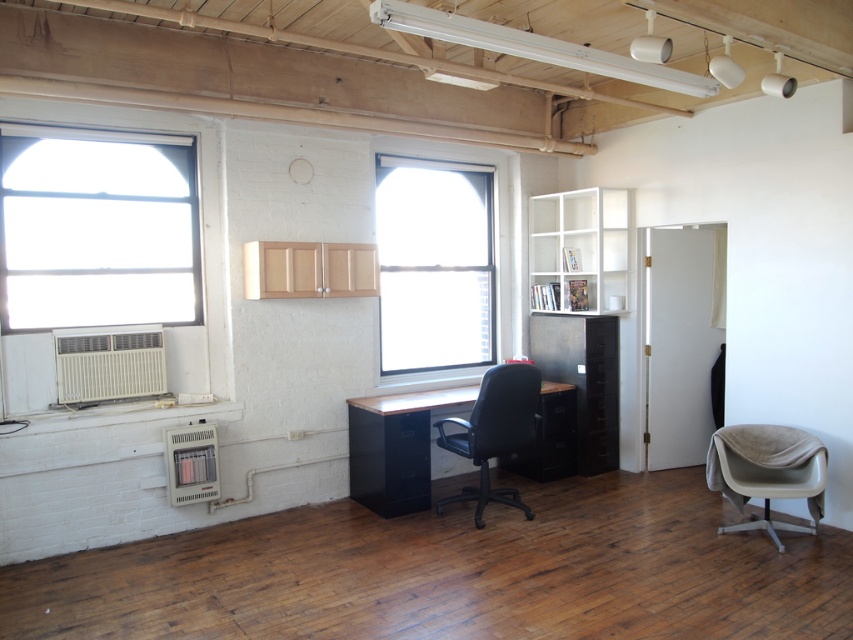
Question: Which of the following is the closest to the observer?

Choices:
 (A) (102, 150)
 (B) (468, 282)

Answer: (A)

Question: Is beige fabric swivel chair at lower right smaller than black leather office chair at center?

Choices:
 (A) no
 (B) yes

Answer: (B)

Question: Observing the image, what is the correct spatial positioning of clear glass window at upper left in reference to beige fabric swivel chair at lower right?

Choices:
 (A) above
 (B) below

Answer: (A)

Question: Which of these objects is positioned farthest from the matte wood desk at center?

Choices:
 (A) clear glass window at upper left
 (B) clear glass window at center
 (C) beige fabric swivel chair at lower right

Answer: (A)

Question: Which point appears closest to the camera in this image?

Choices:
 (A) (486, 314)
 (B) (523, 424)

Answer: (B)

Question: Can you confirm if matte wood desk at center is positioned to the left of beige fabric swivel chair at lower right?

Choices:
 (A) no
 (B) yes

Answer: (B)